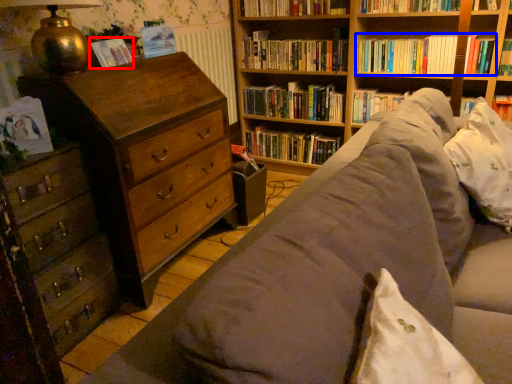
Question: Among these objects, which one is nearest to the camera, paperback book (highlighted by a red box) or book (highlighted by a blue box)?

Choices:
 (A) paperback book
 (B) book

Answer: (A)